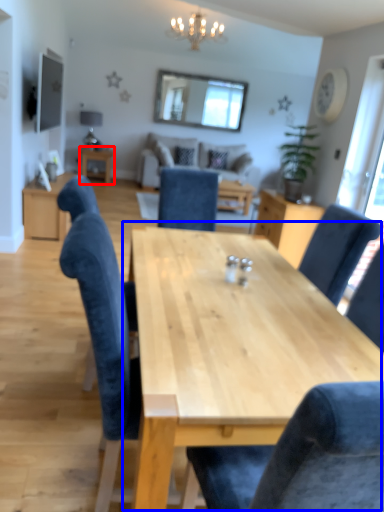
Question: Among these objects, which one is farthest to the camera, table (highlighted by a red box) or table (highlighted by a blue box)?

Choices:
 (A) table
 (B) table

Answer: (A)